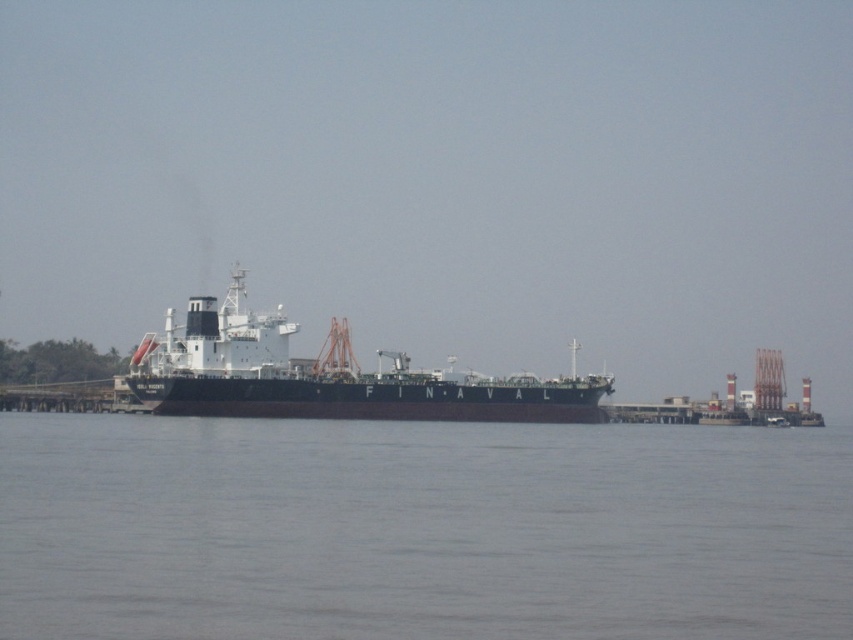
Question: Which point is closer to the camera taking this photo?

Choices:
 (A) (338, 584)
 (B) (409, 419)

Answer: (A)

Question: Does gray water at center appear on the left side of black matte ship at center?

Choices:
 (A) yes
 (B) no

Answer: (B)

Question: Does gray water at center appear over black matte ship at center?

Choices:
 (A) no
 (B) yes

Answer: (A)

Question: Which object appears closest to the camera in this image?

Choices:
 (A) gray water at center
 (B) black matte ship at center

Answer: (A)

Question: Does gray water at center have a greater width compared to black matte ship at center?

Choices:
 (A) no
 (B) yes

Answer: (B)